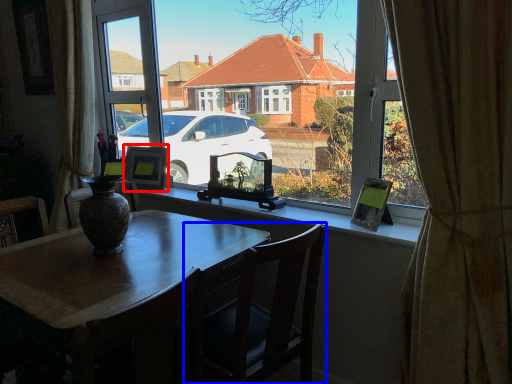
Question: Which of the following is the closest to the observer, picture frame (highlighted by a red box) or chair (highlighted by a blue box)?

Choices:
 (A) picture frame
 (B) chair

Answer: (B)